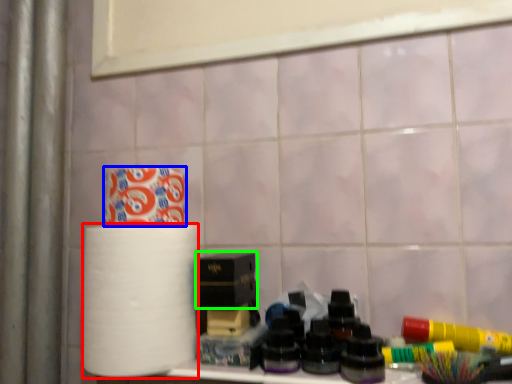
Question: Based on their relative distances, which object is nearer to paper towel (highlighted by a red box)? Choose from toilet paper (highlighted by a blue box) and box (highlighted by a green box).

Choices:
 (A) toilet paper
 (B) box

Answer: (B)